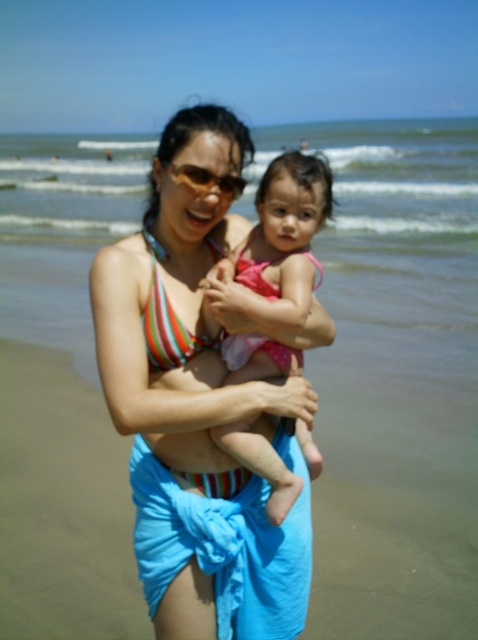
The height and width of the screenshot is (640, 478). I want to click on striped bikini top at center, so click(x=195, y=403).

Image resolution: width=478 pixels, height=640 pixels. What do you see at coordinates (195, 403) in the screenshot? I see `striped bikini top at center` at bounding box center [195, 403].

This screenshot has height=640, width=478. Identify the location of striped bikini top at center. (195, 403).